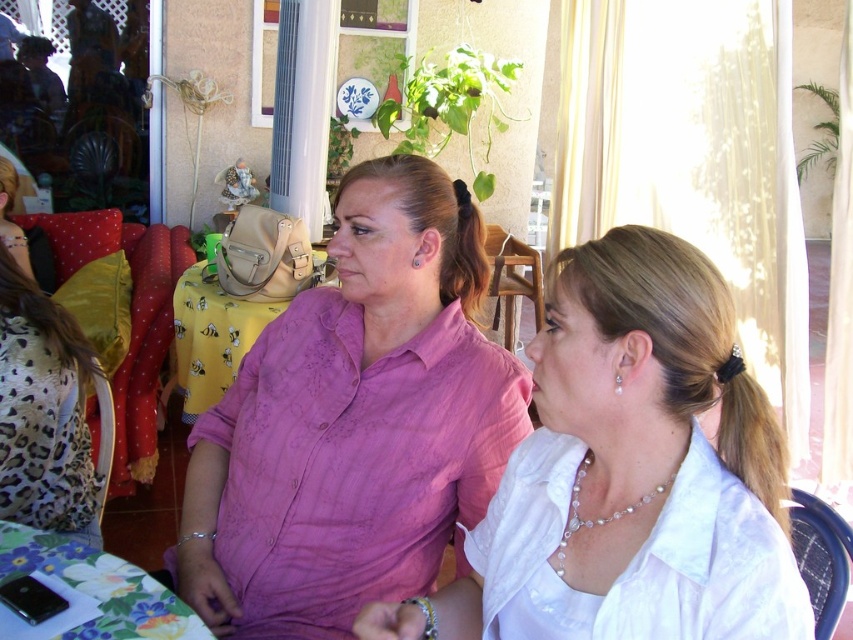
You are a photographer setting up for a portrait. You have a camera with a focal length of 50mm and want to ensure both the pink satin blouse at center and the white satin shirt at center are in focus. Given the hyperfocal distance formula, what is the minimum distance you should focus at to achieve sharpness for both objects if the acceptable circle of confusion is 0.03 mm?

To calculate the minimum focusing distance for both the pink satin blouse at center and the white satin shirt at center, which are 17.32 inches apart, you would use the hyperfocal distance formula. However, without knowing the aperture value, it is impossible to determine the exact distance. The answer requires additional information about the aperture setting used.

You are standing in the cafe and want to place a small plant between the two points, point (769, 548) and point (239, 300). Which point should the plant be closer to in order to be nearer to the viewer?

The plant should be placed closer to point (769, 548) because it is closer to the viewer than point (239, 300).

You are a server in a restaurant and need to place a 2.0 meter long tray between the white satin blouse at center and the yellow fabric table at center. Is there enough space to fit the tray horizontally between them?

The distance between the white satin blouse at center and the yellow fabric table at center is 1.85 meters. Since the tray is 2.0 meters long, which is longer than the available space, the tray cannot be placed horizontally between them.